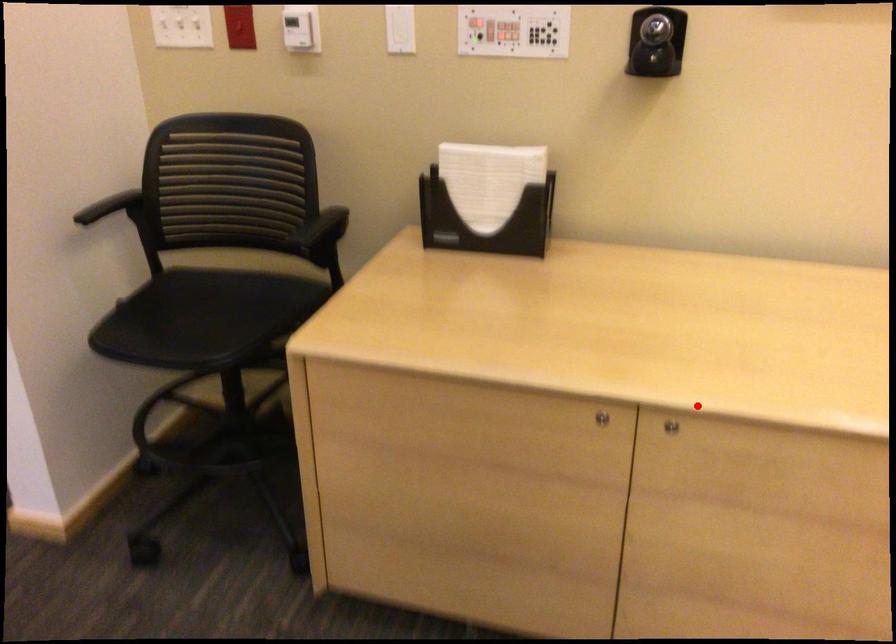
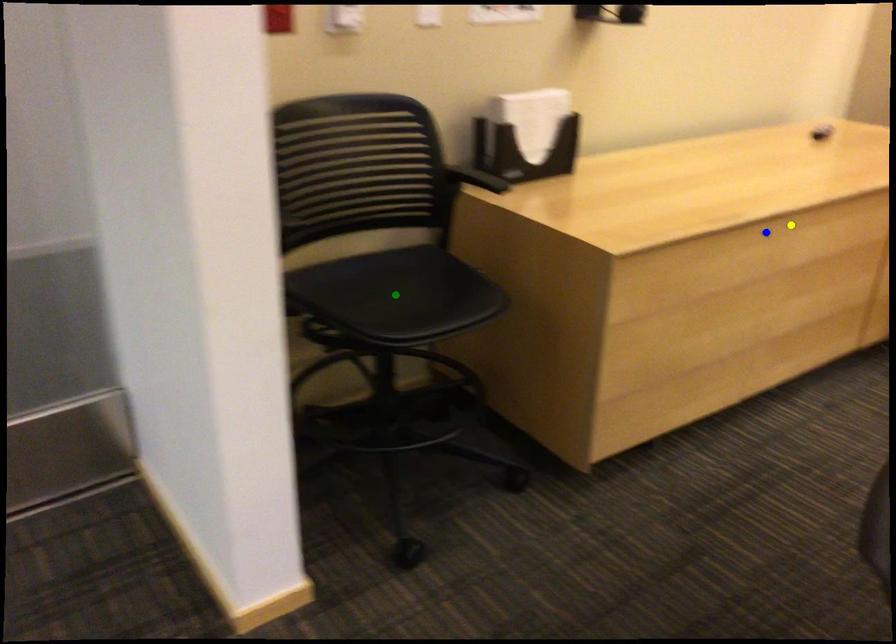
Question: I am providing you with two images of the same scene from different viewpoints. A red point is marked on the first image. You are given multiple points on the second image. Which mark in image 2 goes with the point in image 1?

Choices:
 (A) yellow point
 (B) green point
 (C) blue point

Answer: (A)